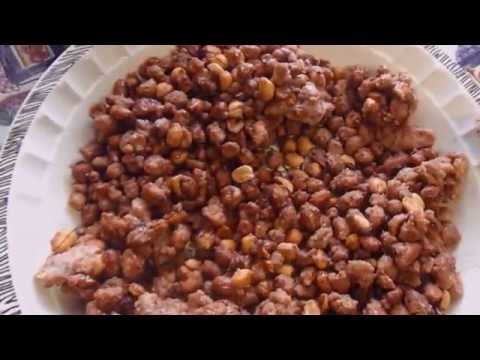
Where is `slats`? The image size is (480, 360). slats is located at coordinates (83, 74), (62, 108), (44, 139), (31, 178), (29, 220), (455, 125), (432, 94), (412, 68), (387, 50).